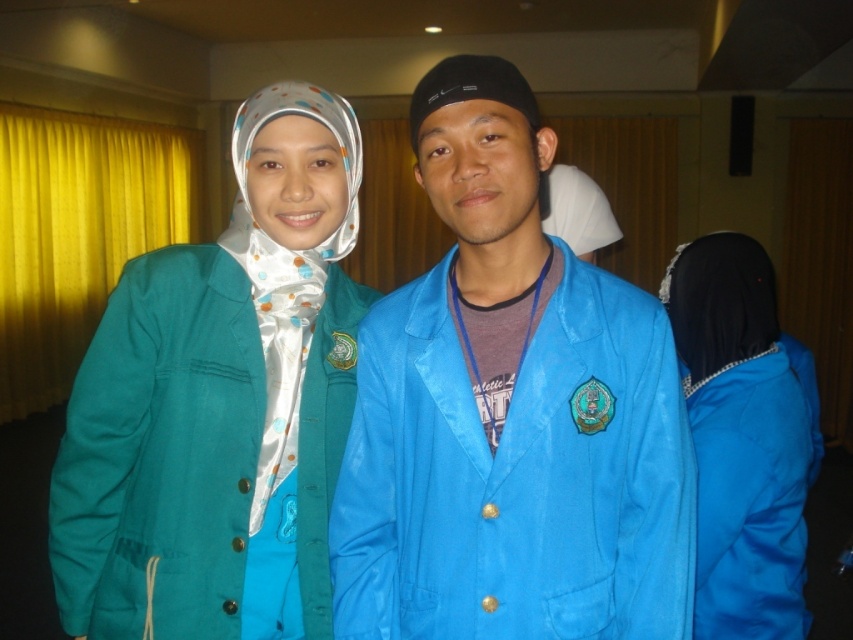
Which of these two, blue fabric jacket at center or blue satin hijab at right, stands taller?

blue satin hijab at right is taller.

Is blue fabric jacket at center below blue satin hijab at right?

No.

Where is `blue fabric jacket at center`? This screenshot has width=853, height=640. blue fabric jacket at center is located at coordinates [509, 412].

You are a GUI agent. You are given a task and a screenshot of the screen. Output one action in this format:
    pyautogui.click(x=<x>, y=<y>)
    Task: Click on the blue fabric jacket at center
    The width and height of the screenshot is (853, 640).
    Given the screenshot: What is the action you would take?
    pyautogui.click(x=509, y=412)

Between teal fabric hijab at left and yellow fabric curtain at left, which one is positioned higher?

yellow fabric curtain at left is above.

Can you confirm if teal fabric hijab at left is taller than yellow fabric curtain at left?

In fact, teal fabric hijab at left may be shorter than yellow fabric curtain at left.

Is point (223, 365) behind point (77, 292)?

No, it is not.

The width and height of the screenshot is (853, 640). What are the coordinates of `teal fabric hijab at left` in the screenshot? It's located at (219, 403).

Is blue fabric jacket at center wider than teal fabric hijab at left?

In fact, blue fabric jacket at center might be narrower than teal fabric hijab at left.

Is blue fabric jacket at center taller than teal fabric hijab at left?

No, blue fabric jacket at center is not taller than teal fabric hijab at left.

Between point (370, 356) and point (262, 307), which one is positioned in front?

Point (370, 356) is more forward.

You are a GUI agent. You are given a task and a screenshot of the screen. Output one action in this format:
    pyautogui.click(x=<x>, y=<y>)
    Task: Click on the blue fabric jacket at center
    
    Given the screenshot: What is the action you would take?
    pyautogui.click(x=509, y=412)